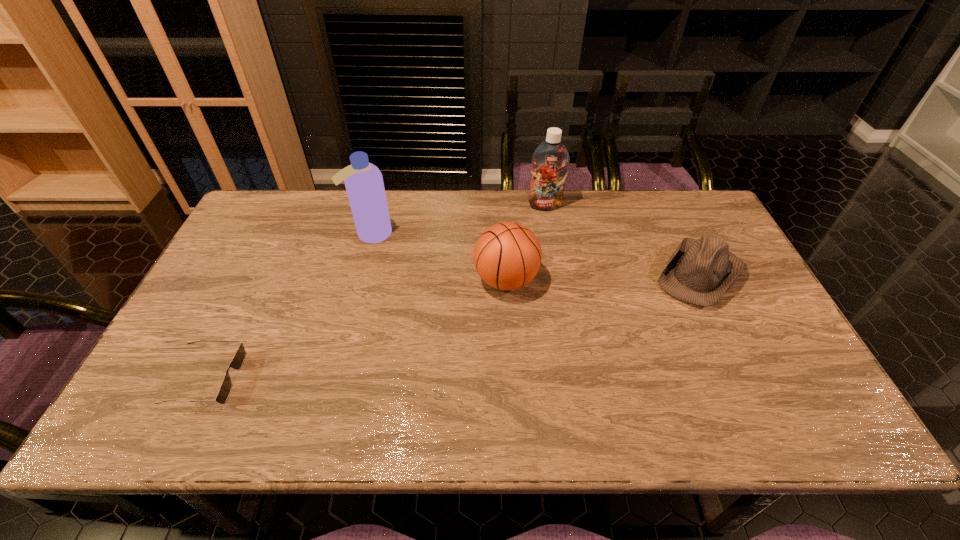
You are a GUI agent. You are given a task and a screenshot of the screen. Output one action in this format:
    pyautogui.click(x=<x>, y=<y>)
    Task: Click on the fourth object from right to left
    Image resolution: width=960 pixels, height=540 pixels.
    Given the screenshot: What is the action you would take?
    pyautogui.click(x=364, y=184)

Locate an element on the screen. the left shampoo is located at coordinates pos(364,184).

Identify the location of the right shampoo. (550, 160).

The height and width of the screenshot is (540, 960). Identify the location of the farther shampoo. (550, 160).

At what (x,y) coordinates should I click in order to perform the action: click on basketball. Please return your answer as a coordinate pair (x, y). Looking at the image, I should click on (507, 256).

The height and width of the screenshot is (540, 960). Find the location of `fedora`. fedora is located at coordinates coord(700,272).

Where is `the fourth tallest object`? the fourth tallest object is located at coordinates (700, 272).

This screenshot has height=540, width=960. I want to click on sunglasses, so coord(238,360).

This screenshot has width=960, height=540. In order to click on the shortest object in this screenshot , I will do `click(238, 360)`.

Identify the location of free space located 0.210m on the right of the left shampoo. (459, 234).